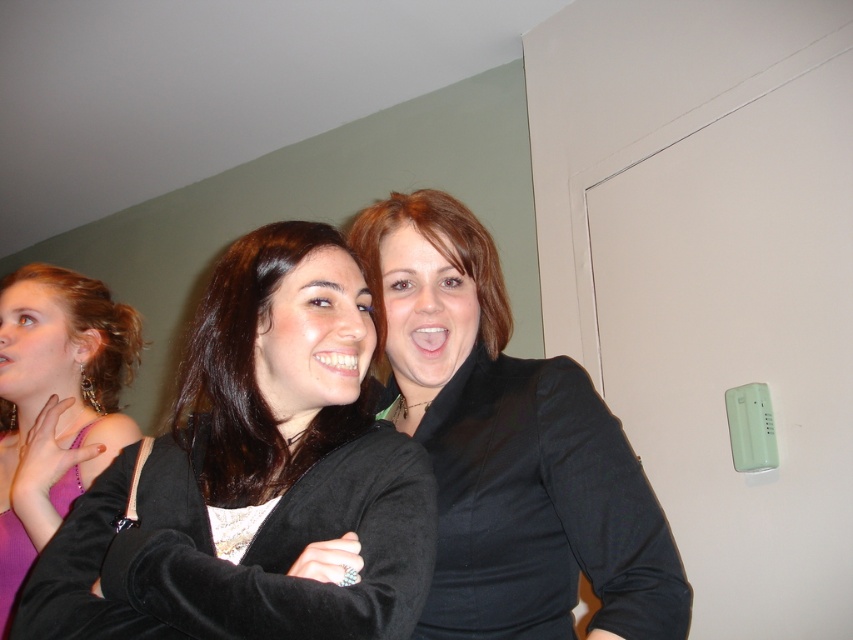
You are trying to locate the black velvet jacket at center in the image. According to the coordinates provided, where would you find it?

The black velvet jacket at center is located at coordinates point [254,476].

You are organizing a photoshoot and need to arrange the black velvet jacket at center and the pink satin dress at left according to their positions in the image. Which item should be placed to the right of the other?

The black velvet jacket at center should be placed to the right of the pink satin dress at left as per the image description.